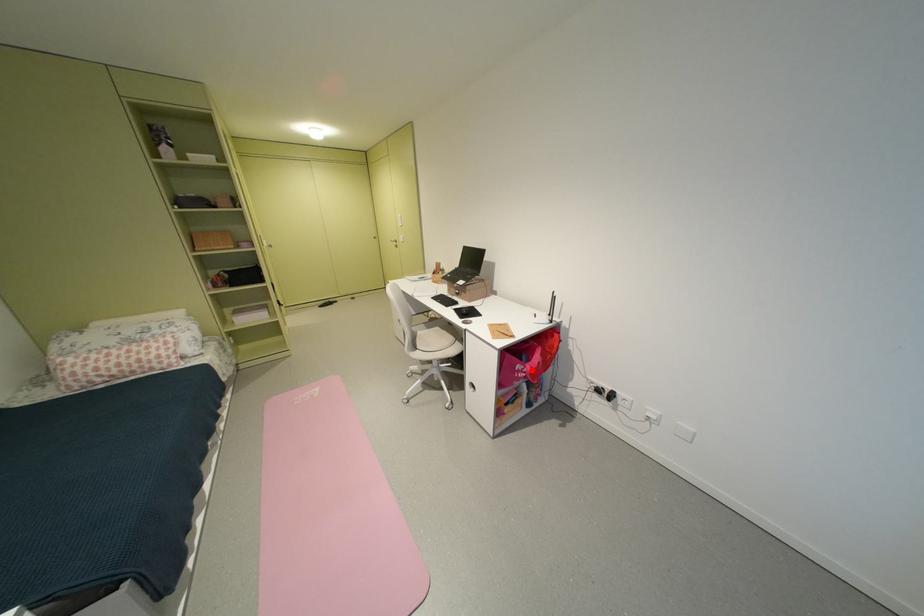
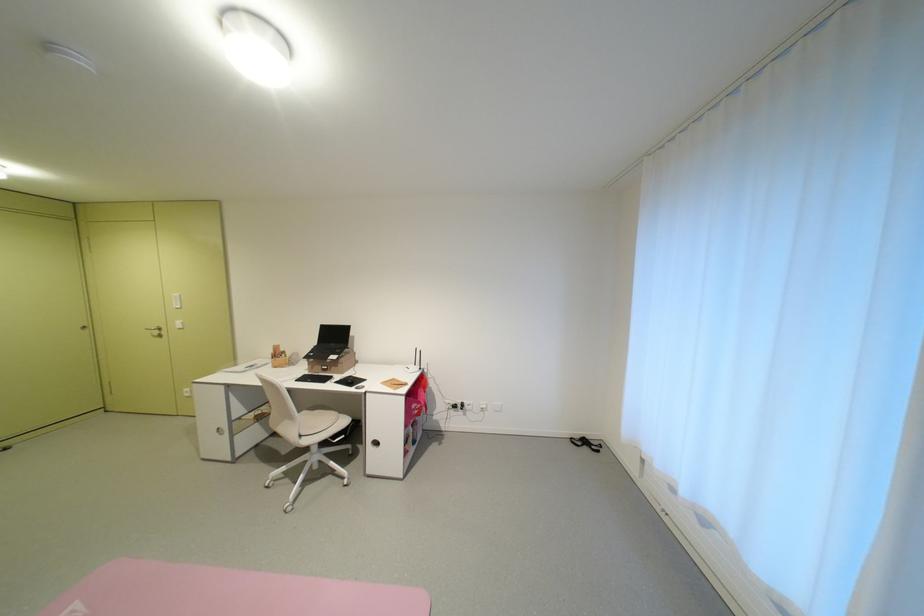
Locate, in the second image, the point that corresponds to the highlighted location in the first image.

(424, 408)